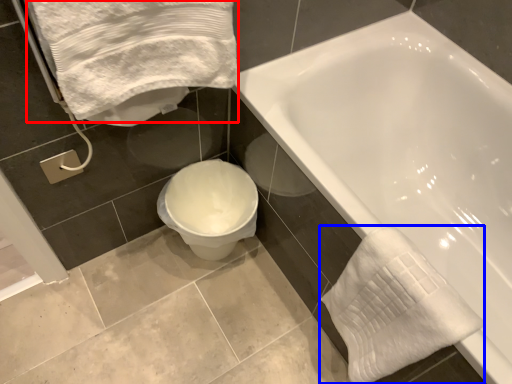
Question: Which object is further to the camera taking this photo, bath towel (highlighted by a red box) or bath towel (highlighted by a blue box)?

Choices:
 (A) bath towel
 (B) bath towel

Answer: (B)